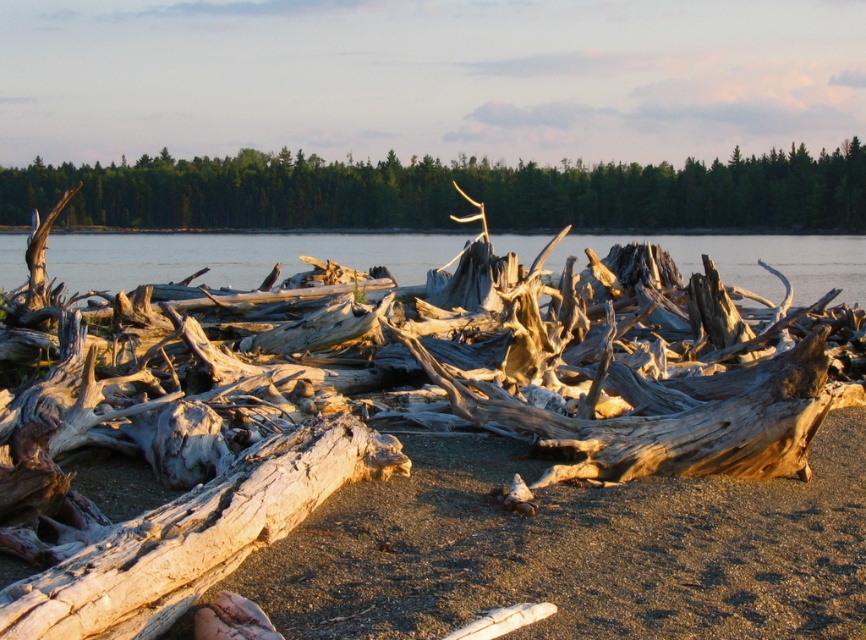
Question: Which point is farther from the camera taking this photo?

Choices:
 (A) (50, 253)
 (B) (62, 625)

Answer: (A)

Question: Is light brown wood at center bigger than clear water at center?

Choices:
 (A) yes
 (B) no

Answer: (B)

Question: Does light brown wood at center appear on the left side of clear water at center?

Choices:
 (A) no
 (B) yes

Answer: (B)

Question: Can you confirm if smooth bark tree trunk at upper center is positioned below clear water at center?

Choices:
 (A) no
 (B) yes

Answer: (A)

Question: Which of these objects is positioned farthest from the clear water at center?

Choices:
 (A) light brown wood at center
 (B) smooth bark tree trunk at upper center

Answer: (A)

Question: Which of the following is the farthest from the observer?

Choices:
 (A) (344, 244)
 (B) (83, 186)

Answer: (B)